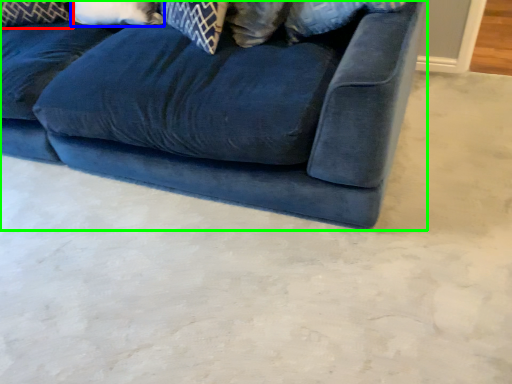
Question: Considering the real-world distances, which object is farthest from pillow (highlighted by a red box)? pillow (highlighted by a blue box) or studio couch (highlighted by a green box)?

Choices:
 (A) pillow
 (B) studio couch

Answer: (B)